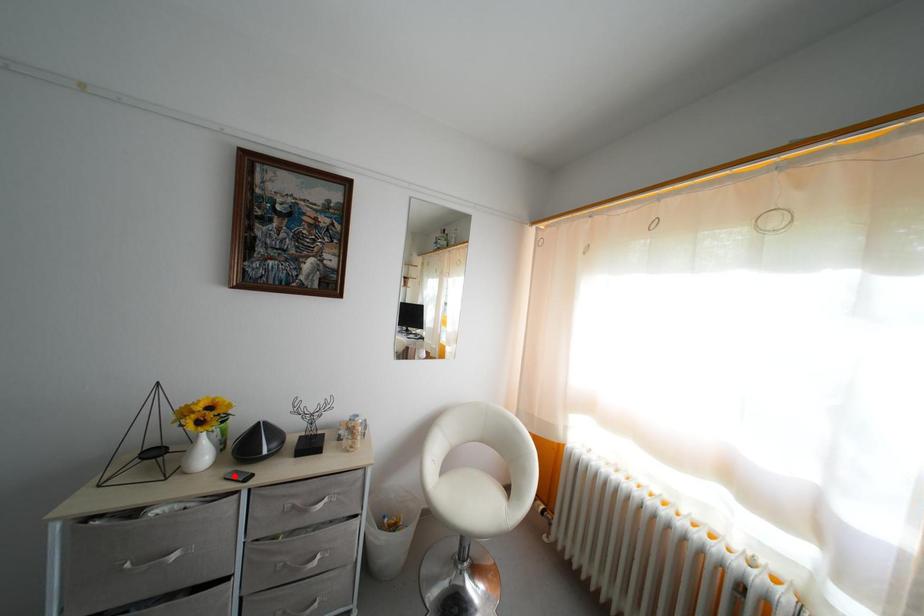
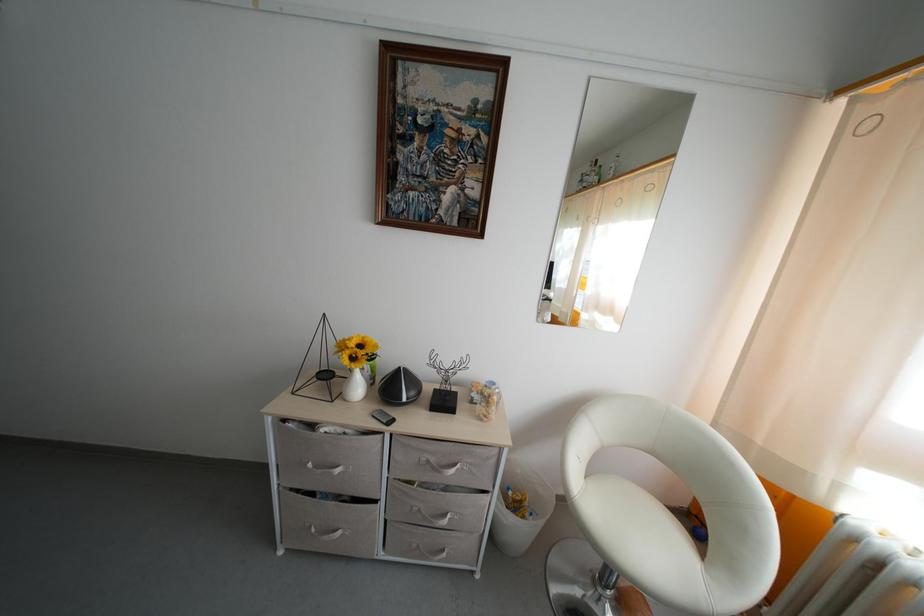
The point at the highlighted location is marked in the first image. Where is the corresponding point in the second image?

(382, 413)